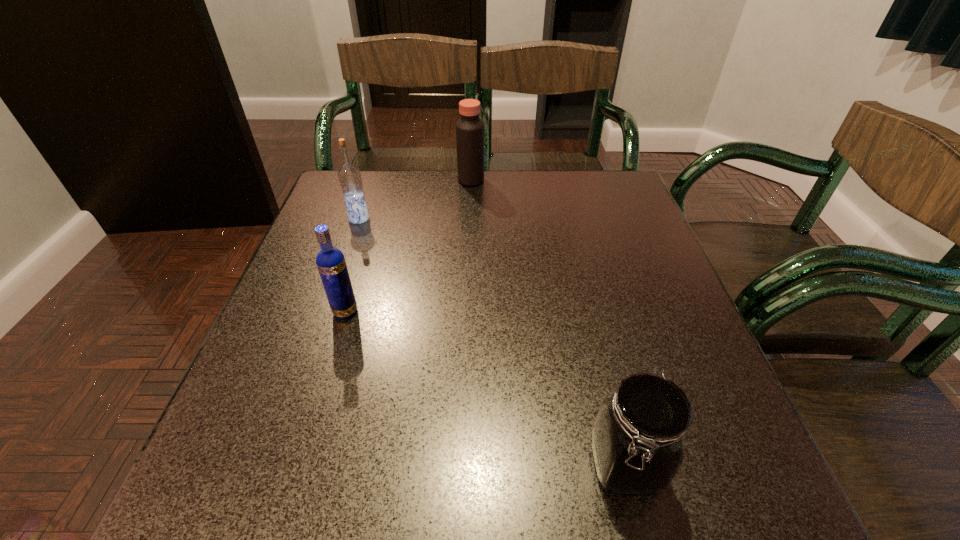
What are the coordinates of `vodka that is at the far edge` in the screenshot? It's located at coord(349,176).

The image size is (960, 540). What are the coordinates of `object at the near edge` in the screenshot? It's located at (637, 438).

Locate an element on the screen. The width and height of the screenshot is (960, 540). object that is at the right edge is located at coordinates (637, 438).

The image size is (960, 540). Identify the location of object that is at the far left corner. (349, 176).

I want to click on object at the near right corner, so coord(637,438).

This screenshot has width=960, height=540. Find the location of `vacant area at the far edge of the desktop`. vacant area at the far edge of the desktop is located at coordinates (462, 192).

Locate an element on the screen. vacant region at the left edge is located at coordinates (289, 294).

Locate an element on the screen. vacant space at the right edge is located at coordinates (638, 221).

You are a GUI agent. You are given a task and a screenshot of the screen. Output one action in this format:
    pyautogui.click(x=<x>, y=<y>)
    Task: Click on the free space at the far left corner
    This screenshot has width=960, height=540.
    Given the screenshot: What is the action you would take?
    pyautogui.click(x=330, y=196)

Identify the location of empty space between the nearer vodka and the shortest object. (485, 388).